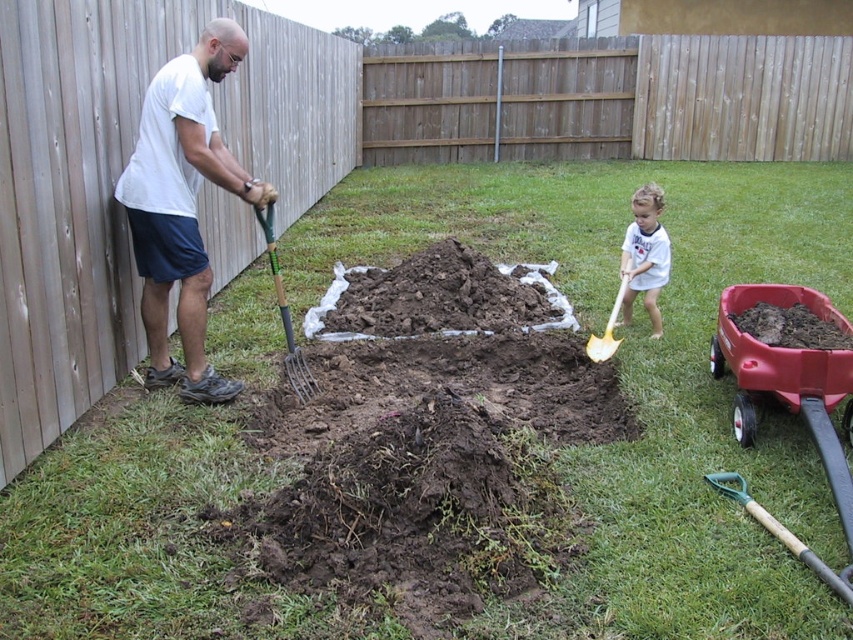
Question: Which is farther from the yellow metallic shovel at right?

Choices:
 (A) white cotton shirt at upper right
 (B) dark brown soil at center
 (C) white matte shirt at left
 (D) dark brown soil at lower right

Answer: (C)

Question: Considering the relative positions of white matte shirt at left and dark brown soil at center in the image provided, where is white matte shirt at left located with respect to dark brown soil at center?

Choices:
 (A) below
 (B) above

Answer: (B)

Question: Based on their relative distances, which object is nearer to the white matte shirt at left?

Choices:
 (A) white cotton shirt at upper right
 (B) yellow metallic shovel at right

Answer: (B)

Question: Which point appears farthest from the camera in this image?

Choices:
 (A) (625, 288)
 (B) (267, 234)
 (C) (834, 330)
 (D) (741, 353)

Answer: (A)

Question: Does red plastic wagon at right have a smaller size compared to dark brown soil at lower right?

Choices:
 (A) yes
 (B) no

Answer: (B)

Question: Is white matte shirt at left thinner than green wooden shovel at center?

Choices:
 (A) yes
 (B) no

Answer: (B)